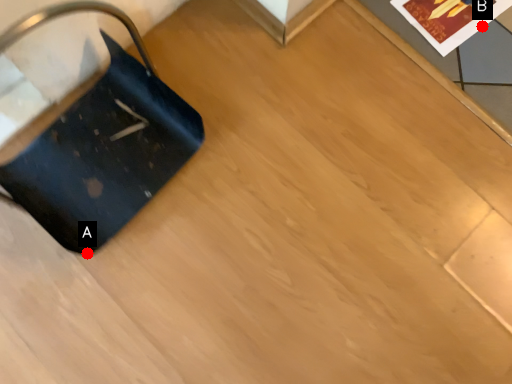
Question: Two points are circled on the image, labeled by A and B beside each circle. Among these points, which one is nearest to the camera?

Choices:
 (A) A is closer
 (B) B is closer

Answer: (A)